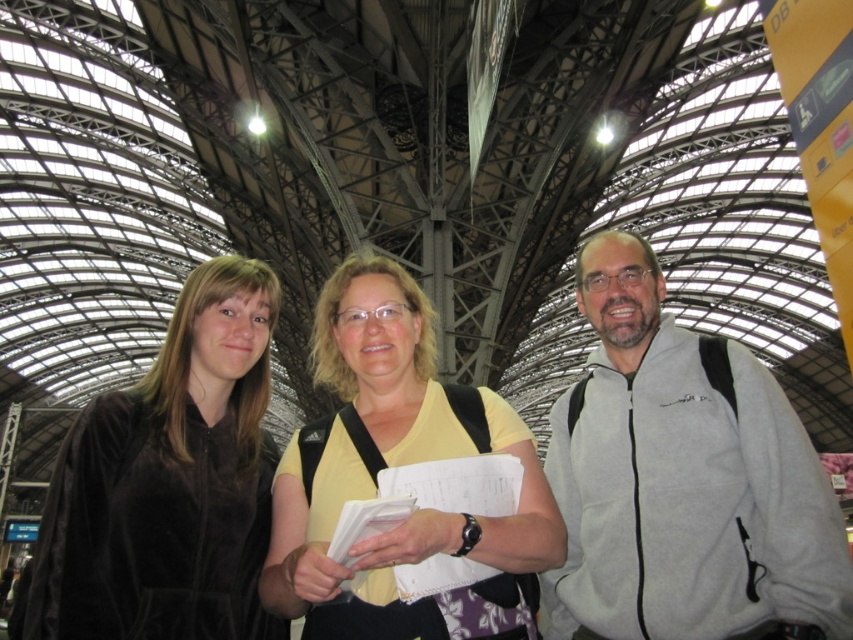
You are standing in the train station and see two points marked on the roof structure. Which point, point (x=149, y=534) or point (x=360, y=550), is closer to you?

Point (x=149, y=534) is closer to you because it is further to the viewer than point (x=360, y=550).

You are a photographer trying to capture a candid shot of the yellow cotton shirt at center without including the gray fleece jacket at right in the frame. Based on their positions, is this possible?

The gray fleece jacket at right is to the right of the yellow cotton shirt at center, so if you position yourself to the left of the yellow cotton shirt at center, you can capture the shot without including the gray fleece jacket at right in the frame.